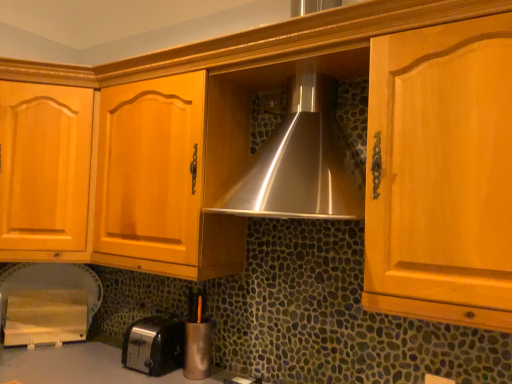
Question: Do you think wooden cutting board at lower left, which is counted as the 1th appliance, starting from the left, is within satin black toaster at lower left, or outside of it?

Choices:
 (A) outside
 (B) inside

Answer: (A)

Question: From a real-world perspective, is wooden cutting board at lower left, which is counted as the 1th appliance, starting from the left, above or below satin black toaster at lower left?

Choices:
 (A) below
 (B) above

Answer: (B)

Question: Which of these objects is positioned farthest from the satin black toaster at lower left?

Choices:
 (A) metallic silver pen holder at lower center, the first appliance viewed from the right
 (B) wooden cutting board at lower left, which is counted as the 1th appliance, starting from the left

Answer: (B)

Question: Estimate the real-world distances between objects in this image. Which object is closer to the wooden cutting board at lower left, which is counted as the 1th appliance, starting from the left?

Choices:
 (A) metallic silver pen holder at lower center, which is the second appliance in back-to-front order
 (B) satin black toaster at lower left

Answer: (B)